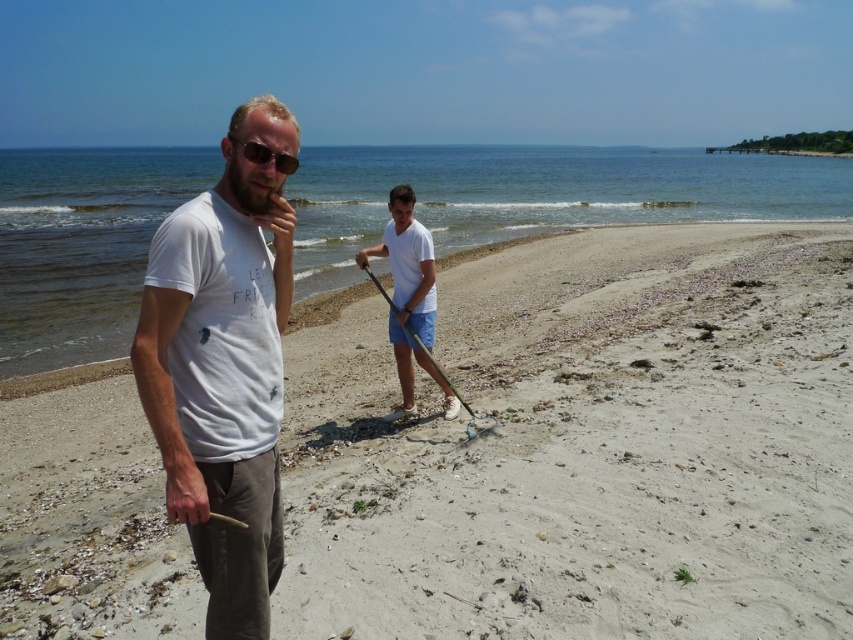
Question: Is white sandy beach at center smaller than matte black sunglasses at center?

Choices:
 (A) no
 (B) yes

Answer: (A)

Question: Which object appears farthest from the camera in this image?

Choices:
 (A) matte black sunglasses at center
 (B) white sandy beach at center
 (C) white matte shirt at center
 (D) white cotton t-shirt at left

Answer: (C)

Question: Which of the following is the closest to the observer?

Choices:
 (A) white cotton t-shirt at left
 (B) white sandy beach at center
 (C) white matte shirt at center

Answer: (A)

Question: Does white cotton t-shirt at left have a lesser width compared to white matte shirt at center?

Choices:
 (A) yes
 (B) no

Answer: (B)

Question: Which point is closer to the camera?

Choices:
 (A) matte black sunglasses at center
 (B) white matte shirt at center
 (C) white sandy beach at center

Answer: (A)

Question: Does white sandy beach at center have a greater width compared to white cotton t-shirt at left?

Choices:
 (A) yes
 (B) no

Answer: (A)